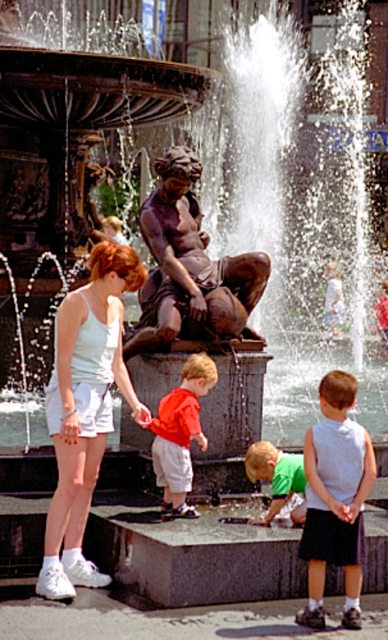
You are standing in front of the fountain and want to place a small flowerpot between the two points, point 1 at point (192, 292) and point 2 at point (173, 512). Which point should you stand closer to in order to place the flowerpot so it appears centered between them from your perspective?

To place the flowerpot so it appears centered between point 1 at (192, 292) and point 2 at (173, 512) from your perspective, you should stand closer to point 2 at (173, 512). This is because point 1 is further away from the viewer than point 2, so the midpoint in 3D space would be closer to the nearer point when viewed from your position.